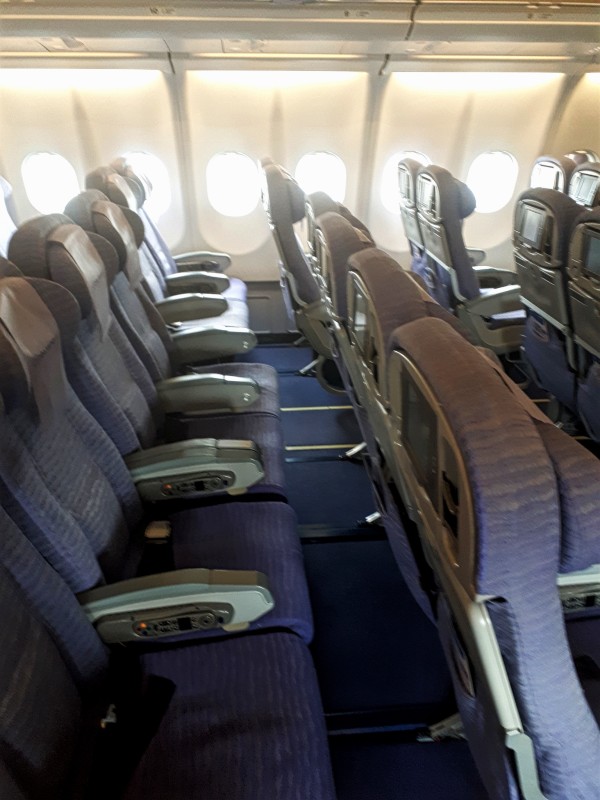
Where is `arm rests`? arm rests is located at coordinates (245, 605), (217, 465), (210, 388), (210, 346), (191, 300), (201, 278), (209, 262), (503, 290), (487, 274), (475, 250).